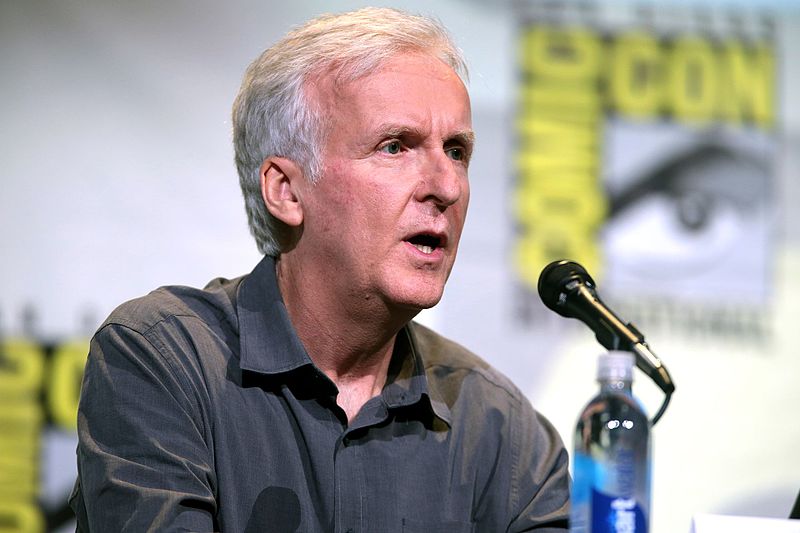
I want to click on audio cable, so click(x=660, y=405).